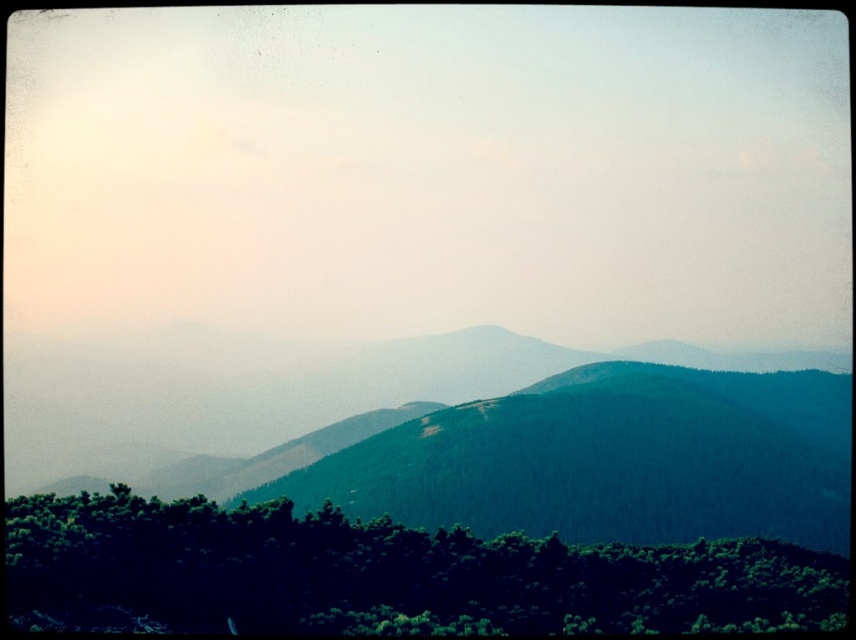
Locate an element on the screen. The height and width of the screenshot is (640, 856). green forested mountain at center is located at coordinates (494, 440).

How distant is green forested mountain at center from green leafy trees at lower center?

105.93 meters

Find the location of a particular element. green forested mountain at center is located at coordinates [x=494, y=440].